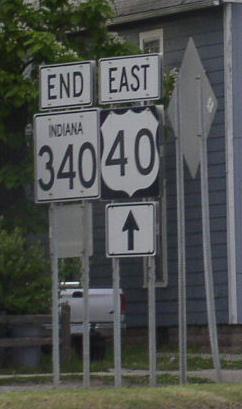
Identify the location of blue walls. (195, 214).